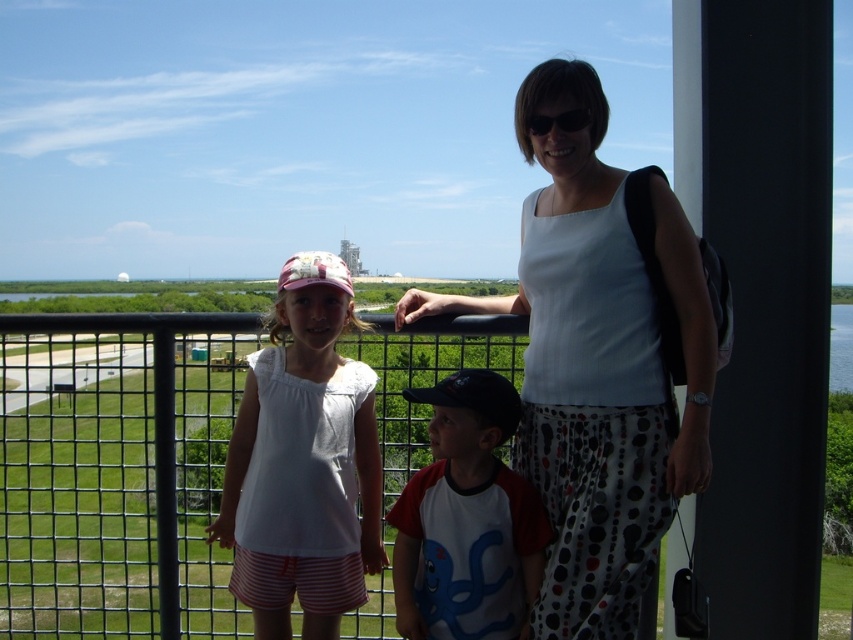
You are a photographer trying to capture a group photo of the white cotton shirt at center and the red and white jersey at center. Which one should you adjust to ensure they are aligned properly?

The white cotton shirt at center is positioned on the left side of the red and white jersey at center, so you should move the red and white jersey at center to the left or the white cotton shirt at center to the right to align them properly.